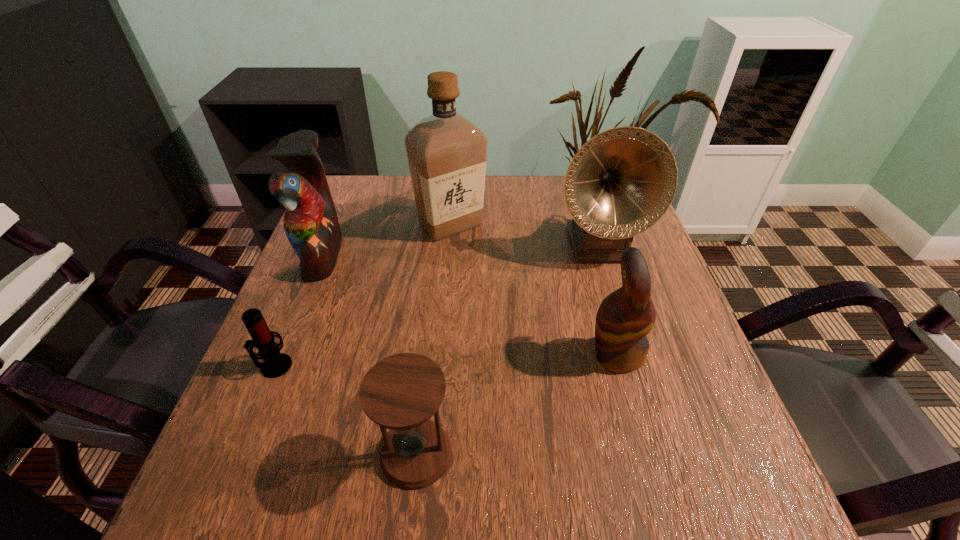
The image size is (960, 540). In order to click on unoccupied area between the right parrot and the tallest object in this screenshot , I will do coord(534,289).

Locate an element on the screen. This screenshot has height=540, width=960. empty space that is in between the nearest object and the liquor is located at coordinates (433, 339).

The height and width of the screenshot is (540, 960). I want to click on vacant area that lies between the microphone and the liquor, so click(x=362, y=295).

At what (x,y) coordinates should I click in order to perform the action: click on vacant space that's between the shortest object and the farther parrot. Please return your answer as a coordinate pair (x, y). The image size is (960, 540). Looking at the image, I should click on (298, 310).

Identify the location of unoccupied area between the farther parrot and the nearest object. (370, 354).

Locate an element on the screen. The height and width of the screenshot is (540, 960). vacant space that's between the tallest object and the hourglass is located at coordinates (433, 339).

This screenshot has width=960, height=540. What are the coordinates of `unoccupied area between the fifth tallest object and the farther parrot` in the screenshot? It's located at (370, 354).

Locate an element on the screen. vacant point located between the phonograph record and the nearest object is located at coordinates (507, 349).

Find the location of `object that is the closest one to the tallest object`. object that is the closest one to the tallest object is located at coordinates (622, 181).

Image resolution: width=960 pixels, height=540 pixels. I want to click on object that is the closest to the hourglass, so click(x=276, y=364).